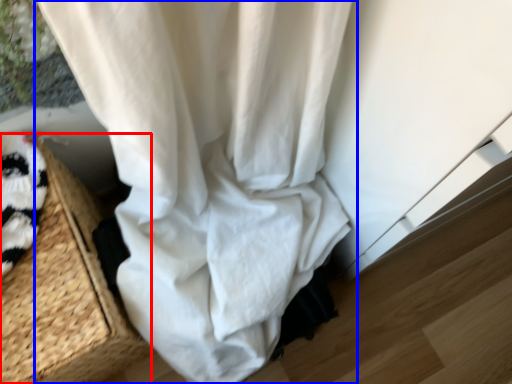
Question: Which of the following is the closest to the observer, basket (highlighted by a red box) or curtain (highlighted by a blue box)?

Choices:
 (A) basket
 (B) curtain

Answer: (A)